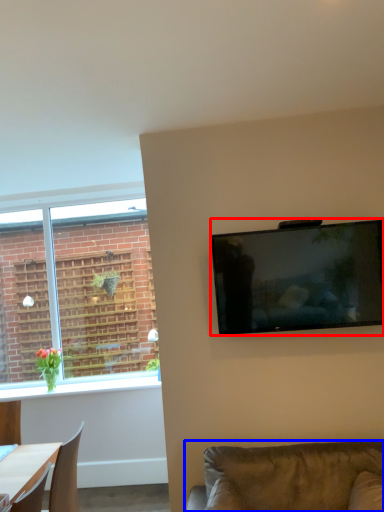
Question: Which object is further to the camera taking this photo, television (highlighted by a red box) or studio couch (highlighted by a blue box)?

Choices:
 (A) television
 (B) studio couch

Answer: (A)